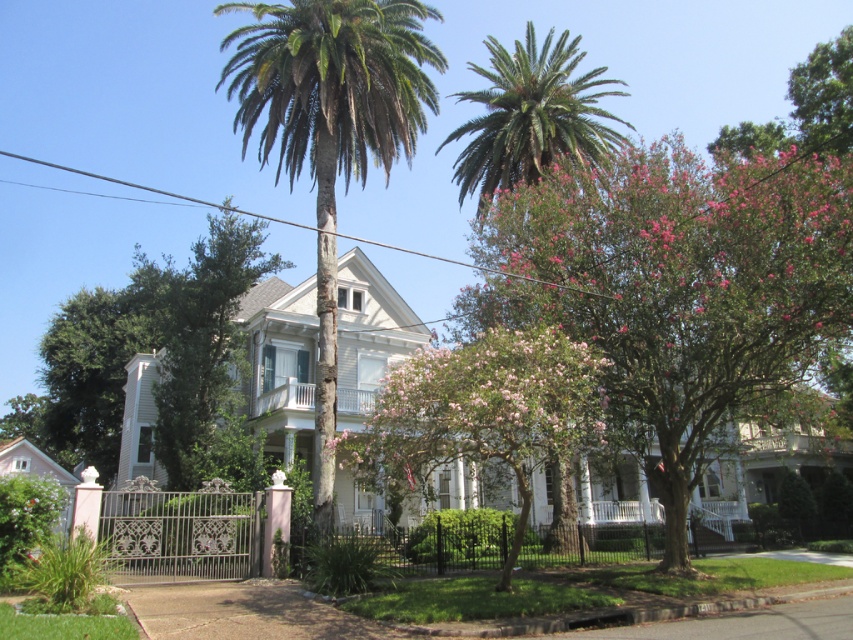
Is pink bloom tree at center shorter than green leafy palm tree at upper center?

Correct, pink bloom tree at center is not as tall as green leafy palm tree at upper center.

Identify the location of pink bloom tree at center. (485, 412).

Does green textured palm tree at center have a greater width compared to green leafy palm tree at upper center?

In fact, green textured palm tree at center might be narrower than green leafy palm tree at upper center.

Is point (321, 122) closer to camera compared to point (575, 148)?

Yes, point (321, 122) is closer to viewer.

Image resolution: width=853 pixels, height=640 pixels. I want to click on green textured palm tree at center, so tap(329, 131).

Does pink leafy tree at upper right have a smaller size compared to green textured palm tree at center?

Yes, pink leafy tree at upper right is smaller than green textured palm tree at center.

Is pink leafy tree at upper right positioned in front of green textured palm tree at center?

Yes, it is.

Identify the location of pink leafy tree at upper right. (677, 285).

The width and height of the screenshot is (853, 640). I want to click on pink leafy tree at upper right, so click(x=677, y=285).